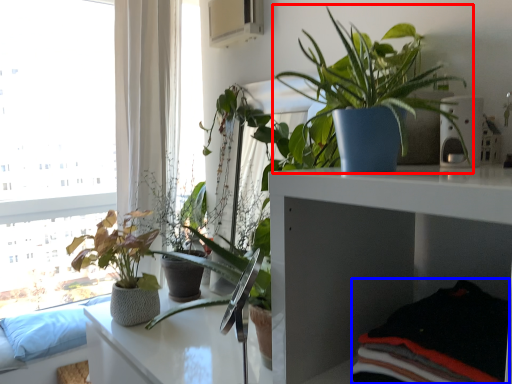
Question: Among these objects, which one is nearest to the camera, houseplant (highlighted by a red box) or clothing (highlighted by a blue box)?

Choices:
 (A) houseplant
 (B) clothing

Answer: (B)